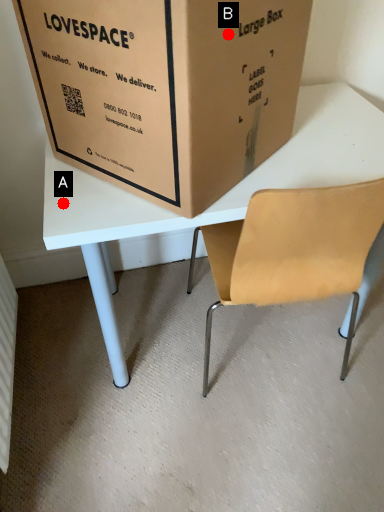
Question: Two points are circled on the image, labeled by A and B beside each circle. Which of the following is the farthest from the observer?

Choices:
 (A) A is further
 (B) B is further

Answer: (A)